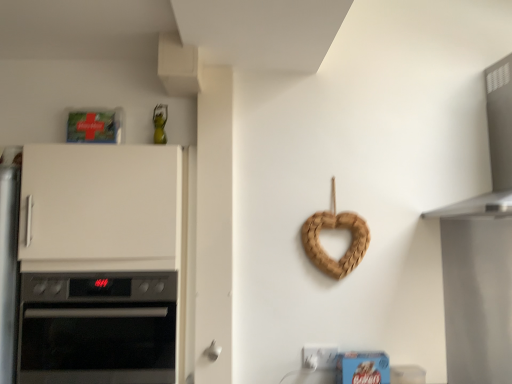
Question: From the image's perspective, does white matte door handle at lower center appear lower than white matte cabinet at left?

Choices:
 (A) no
 (B) yes

Answer: (B)

Question: Is white matte door handle at lower center not inside white matte cabinet at left?

Choices:
 (A) yes
 (B) no

Answer: (A)

Question: Does white matte door handle at lower center have a greater width compared to white matte cabinet at left?

Choices:
 (A) no
 (B) yes

Answer: (A)

Question: Is the position of white matte door handle at lower center more distant than that of white matte cabinet at left?

Choices:
 (A) yes
 (B) no

Answer: (A)

Question: Considering the relative positions of white matte door handle at lower center and white matte cabinet at left in the image provided, is white matte door handle at lower center to the right of white matte cabinet at left from the viewer's perspective?

Choices:
 (A) yes
 (B) no

Answer: (A)

Question: Does white matte door handle at lower center turn towards white matte cabinet at left?

Choices:
 (A) yes
 (B) no

Answer: (B)

Question: Does braided wood heart at center-right have a larger size compared to satin silver vent at upper right?

Choices:
 (A) no
 (B) yes

Answer: (A)

Question: Is braided wood heart at center-right positioned behind satin silver vent at upper right?

Choices:
 (A) yes
 (B) no

Answer: (A)

Question: Is braided wood heart at center-right oriented away from satin silver vent at upper right?

Choices:
 (A) yes
 (B) no

Answer: (B)

Question: From the image's perspective, is braided wood heart at center-right above satin silver vent at upper right?

Choices:
 (A) yes
 (B) no

Answer: (B)

Question: Considering the relative sizes of braided wood heart at center-right and satin silver vent at upper right in the image provided, is braided wood heart at center-right wider than satin silver vent at upper right?

Choices:
 (A) no
 (B) yes

Answer: (A)

Question: Is braided wood heart at center-right taller than satin silver vent at upper right?

Choices:
 (A) yes
 (B) no

Answer: (B)

Question: Does black glass oven at left have a lesser height compared to braided wood heart at center-right?

Choices:
 (A) yes
 (B) no

Answer: (B)